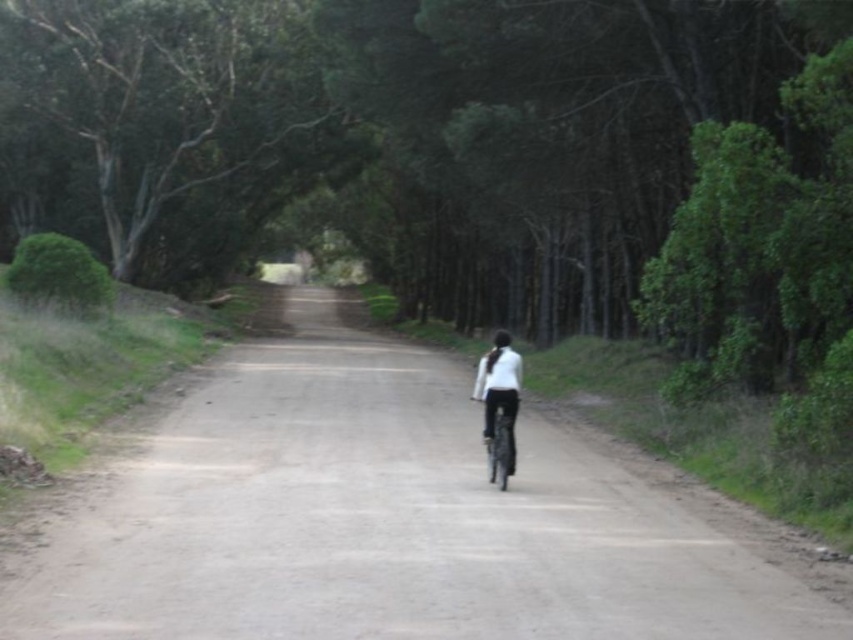
You are a cyclist approaching the dirt road at center and the white matte jacket at center. Which object will you encounter first as you move forward?

The dirt road at center is larger in size than white matte jacket at center, so you will encounter the dirt road at center first because it occupies more space in your path.

You are a hiker who wants to reach the green leafy tree at upper center from your current position near the white matte jacket at center. Given that you can walk at a speed of 3 feet per second, how long will it take you to reach the tree?

The distance between the green leafy tree at upper center and the white matte jacket at center is 73.87 feet. At a walking speed of 3 feet per second, it would take approximately 24.6 seconds to reach the tree.

You are planning to take a photo of the dirt road at center and the shiny metallic bicycle at center. Which object should you focus on if you want to capture the larger subject in your shot?

The dirt road at center is bigger than the shiny metallic bicycle at center, so you should focus on the dirt road at center to capture the larger subject in your shot.